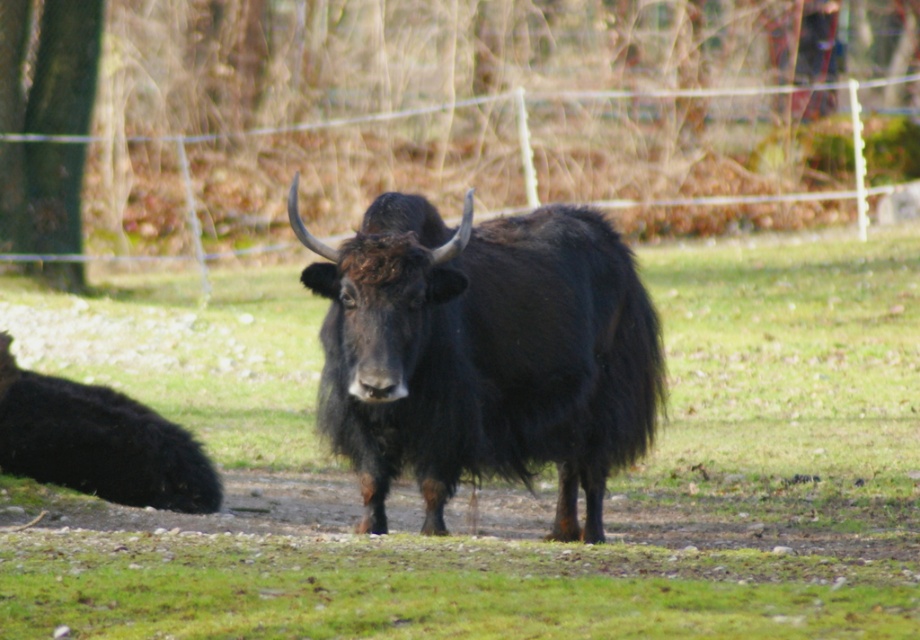
Looking at this image, is black fuzzy yak at center wider than black fuzzy yak at lower left?

Yes.

Which of these two, black fuzzy yak at center or black fuzzy yak at lower left, stands shorter?

Standing shorter between the two is black fuzzy yak at lower left.

I want to click on black fuzzy yak at center, so click(504, 484).

Is black fuzzy bull at center wider than black fuzzy yak at lower left?

Indeed, black fuzzy bull at center has a greater width compared to black fuzzy yak at lower left.

Consider the image. Is black fuzzy bull at center smaller than black fuzzy yak at lower left?

Incorrect, black fuzzy bull at center is not smaller in size than black fuzzy yak at lower left.

Measure the distance between black fuzzy bull at center and camera.

black fuzzy bull at center is 20.84 feet from camera.

The image size is (920, 640). In order to click on black fuzzy bull at center in this screenshot , I will do `click(483, 353)`.

From the picture: Does black fuzzy yak at center have a smaller size compared to black fuzzy bull at center?

No.

Who is positioned more to the right, black fuzzy yak at center or black fuzzy bull at center?

From the viewer's perspective, black fuzzy yak at center appears more on the right side.

Where is `black fuzzy yak at center`? The width and height of the screenshot is (920, 640). black fuzzy yak at center is located at coordinates (504, 484).

Locate an element on the screen. The image size is (920, 640). black fuzzy yak at center is located at coordinates (504, 484).